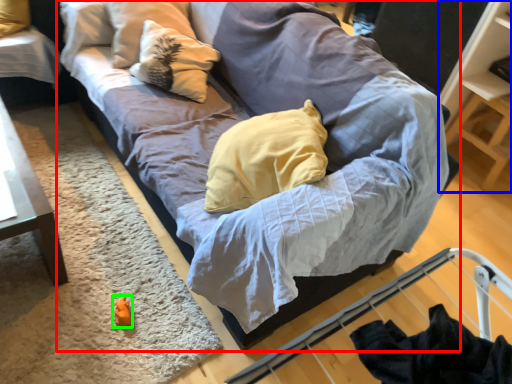
Question: Which is nearer to the studio couch (highlighted by a red box)? shelf (highlighted by a blue box) or toy (highlighted by a green box).

Choices:
 (A) shelf
 (B) toy

Answer: (B)